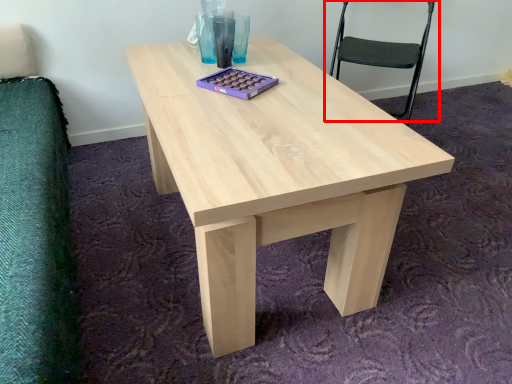
Question: From the image's perspective, what is the correct spatial positioning of chair (annotated by the red box) in reference to coffee table?

Choices:
 (A) above
 (B) below

Answer: (A)